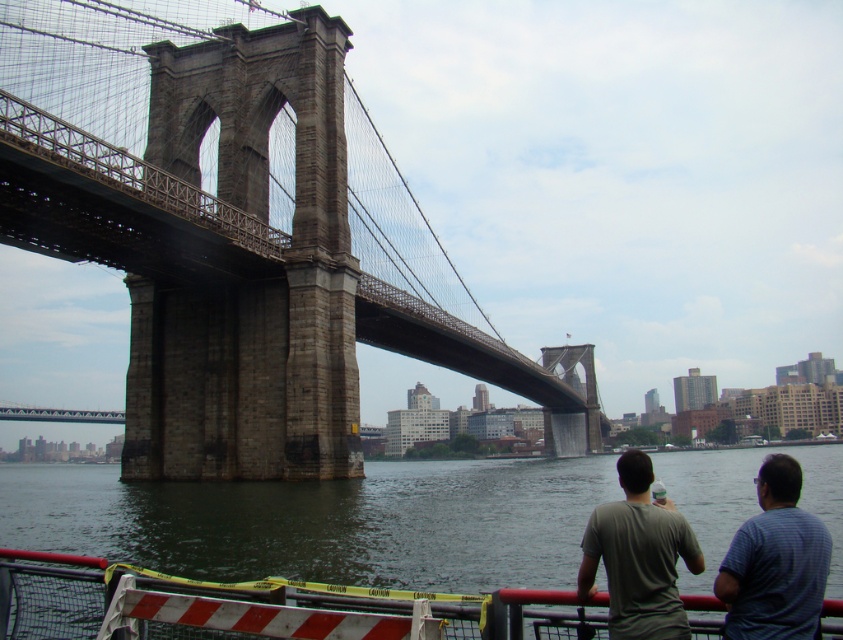
Question: Is stone bridge at center to the right of gray cotton shirt at lower right from the viewer's perspective?

Choices:
 (A) yes
 (B) no

Answer: (B)

Question: Is dark gray water at lower center bigger than dark gray t-shirt at center?

Choices:
 (A) no
 (B) yes

Answer: (B)

Question: Is stone bridge at center closer to the viewer compared to gray striped shirt at right?

Choices:
 (A) no
 (B) yes

Answer: (A)

Question: Which object is farther from the camera taking this photo?

Choices:
 (A) dark gray t-shirt at center
 (B) gray striped shirt at right

Answer: (A)

Question: Which object is farther from the camera taking this photo?

Choices:
 (A) dark gray t-shirt at center
 (B) gray cotton shirt at lower right
 (C) dark gray water at lower center

Answer: (C)

Question: Which of these objects is positioned farthest from the gray cotton shirt at lower right?

Choices:
 (A) gray striped shirt at right
 (B) dark gray t-shirt at center

Answer: (A)